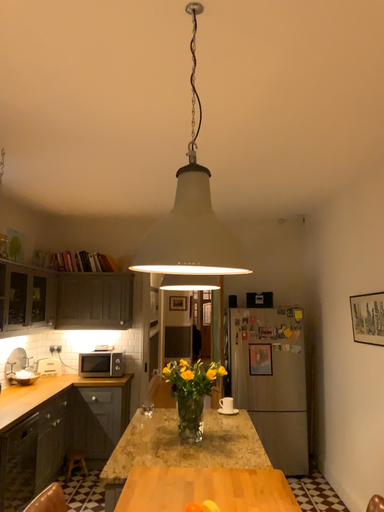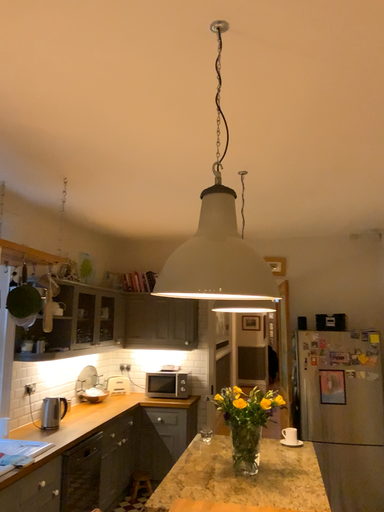
Question: Which way did the camera rotate in the video?

Choices:
 (A) rotated left
 (B) rotated right

Answer: (A)